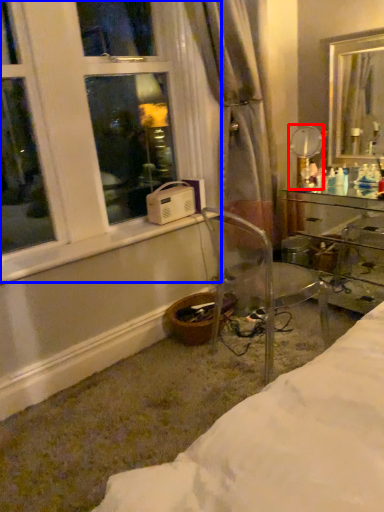
Question: Which point is further to the camera, mirror (highlighted by a red box) or window (highlighted by a blue box)?

Choices:
 (A) mirror
 (B) window

Answer: (A)